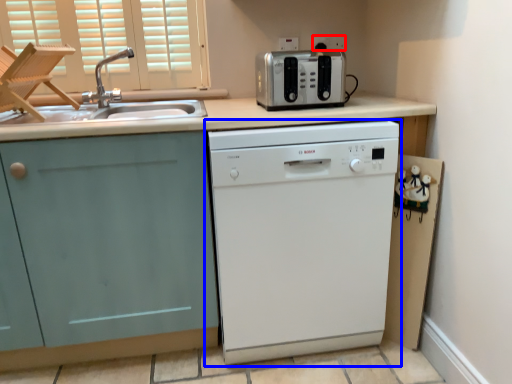
Question: Which object appears farthest to the camera in this image, electric outlet (highlighted by a red box) or home appliance (highlighted by a blue box)?

Choices:
 (A) electric outlet
 (B) home appliance

Answer: (A)